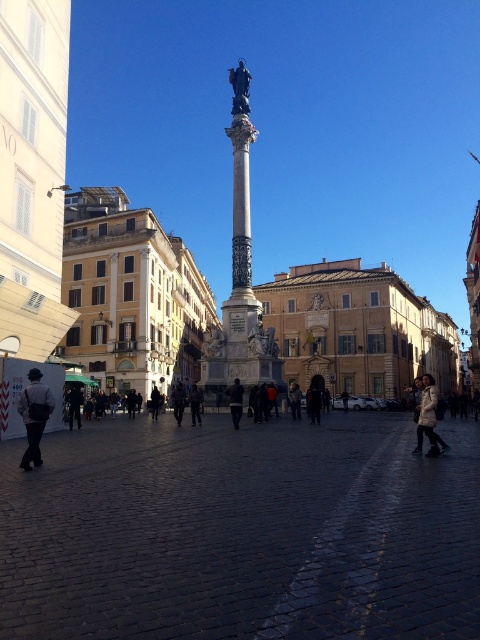
Can you confirm if dark cobblestone plaza at center is positioned below dark brown leather jacket at center?

Actually, dark cobblestone plaza at center is above dark brown leather jacket at center.

Which is more to the right, dark cobblestone plaza at center or dark brown leather jacket at center?

dark cobblestone plaza at center is more to the right.

Locate an element on the screen. dark cobblestone plaza at center is located at coordinates (242, 532).

The height and width of the screenshot is (640, 480). What are the coordinates of `dark cobblestone plaza at center` in the screenshot? It's located at (242, 532).

Between white textured coat at lower right and dark gray jacket at lower left, which one appears on the left side from the viewer's perspective?

From the viewer's perspective, dark gray jacket at lower left appears more on the left side.

From the picture: Which is below, white textured coat at lower right or dark gray jacket at lower left?

Positioned lower is dark gray jacket at lower left.

Does point (430, 388) come farther from viewer compared to point (72, 404)?

No, it is not.

Where is `white textured coat at lower right`? white textured coat at lower right is located at coordinates [428, 417].

Does dark gray fabric jacket at lower left appear over dark gray jacket at center?

Yes.

Can you confirm if dark gray fabric jacket at lower left is positioned to the left of dark gray jacket at center?

Indeed, dark gray fabric jacket at lower left is positioned on the left side of dark gray jacket at center.

You are a GUI agent. You are given a task and a screenshot of the screen. Output one action in this format:
    pyautogui.click(x=<x>, y=<y>)
    Task: Click on the dark gray fabric jacket at lower left
    This screenshot has height=640, width=480.
    Given the screenshot: What is the action you would take?
    pyautogui.click(x=35, y=416)